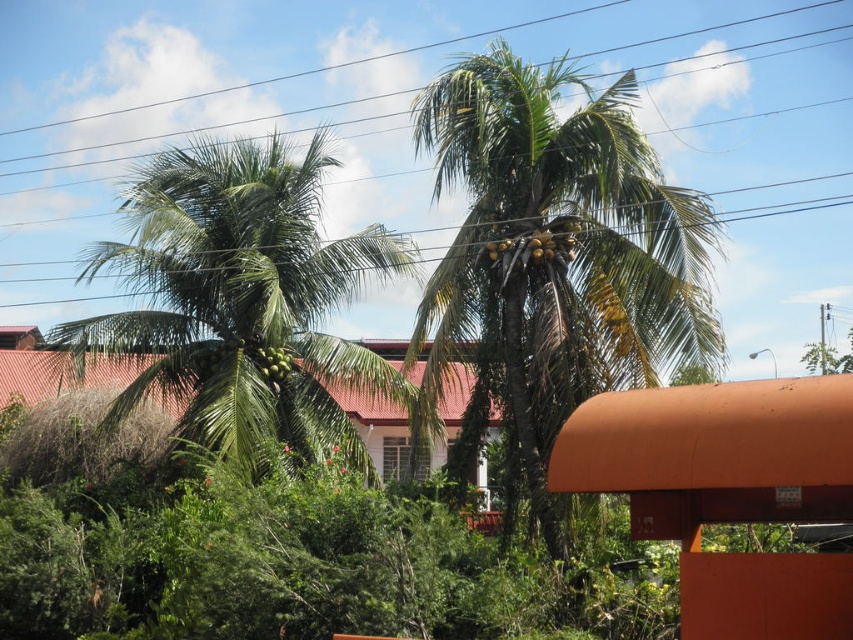
Question: Among these points, which one is farthest from the camera?

Choices:
 (A) (294, 410)
 (B) (271, 3)
 (C) (467, 84)

Answer: (B)

Question: From the image, what is the correct spatial relationship of metallic wire at upper center in relation to green leafy coconut tree at left?

Choices:
 (A) below
 (B) above

Answer: (A)

Question: Which object appears farthest from the camera in this image?

Choices:
 (A) green leafy palm at center
 (B) green leafy coconut tree at left
 (C) metallic wire at upper center

Answer: (C)

Question: Based on their relative distances, which object is nearer to the metallic wire at upper center?

Choices:
 (A) green leafy palm at center
 (B) green leafy coconut tree at left

Answer: (B)

Question: Is green leafy palm at center wider than green leafy coconut tree at left?

Choices:
 (A) yes
 (B) no

Answer: (B)

Question: In this image, where is green leafy palm at center located relative to green leafy coconut tree at left?

Choices:
 (A) below
 (B) above

Answer: (B)